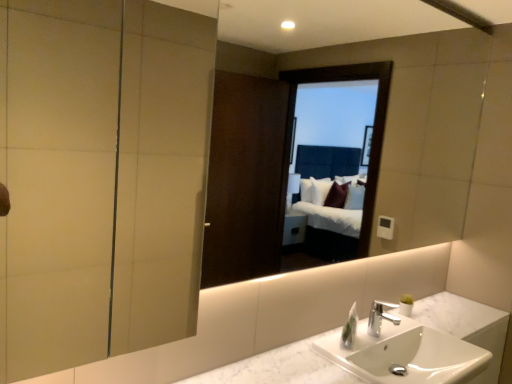
Question: Would you say white marble sink at lower center is to the left or to the right of matte glass screen door at upper left in the picture?

Choices:
 (A) left
 (B) right

Answer: (B)

Question: Is white marble sink at lower center in front of or behind matte glass screen door at upper left in the image?

Choices:
 (A) behind
 (B) front

Answer: (A)

Question: Considering the real-world distances, which object is closest to the silver metallic faucet at center?

Choices:
 (A) white glossy soap dispenser at lower right
 (B) white marble counter top at center
 (C) matte glass screen door at upper left
 (D) white marble sink at lower center

Answer: (A)

Question: Which of these objects is positioned farthest from the white glossy soap dispenser at lower right?

Choices:
 (A) silver metallic faucet at center
 (B) matte glass screen door at upper left
 (C) white marble sink at lower center
 (D) white marble counter top at center

Answer: (B)